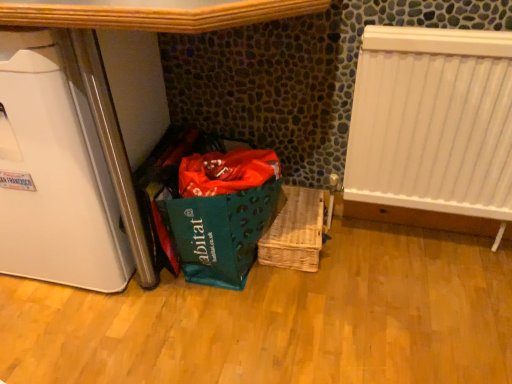
This screenshot has height=384, width=512. What are the coordinates of `vacant area that lies to the right of woven wood basket at center` in the screenshot? It's located at (361, 255).